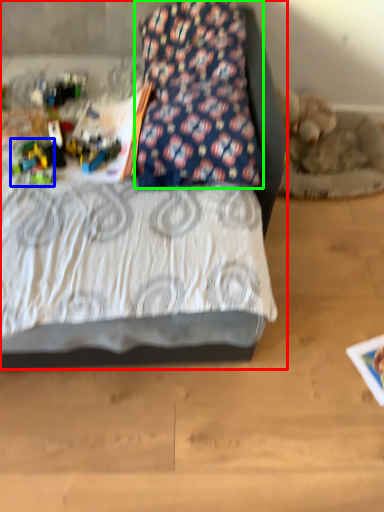
Question: Based on their relative distances, which object is farther from bed (highlighted by a red box)? Choose from toy (highlighted by a blue box) and pillow (highlighted by a green box).

Choices:
 (A) toy
 (B) pillow

Answer: (B)